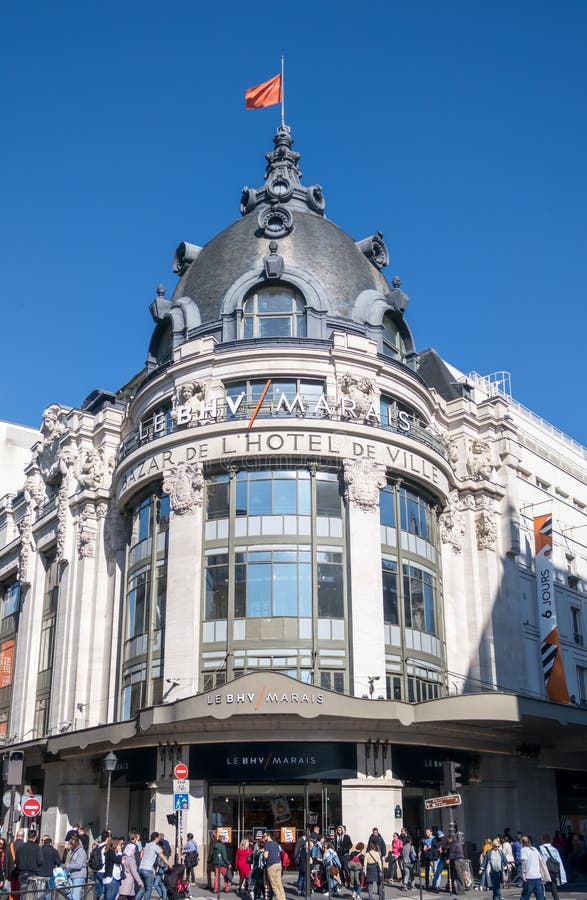
Find the location of a particular element. The width and height of the screenshot is (587, 900). entrance is located at coordinates (229, 840), (247, 832), (286, 846).